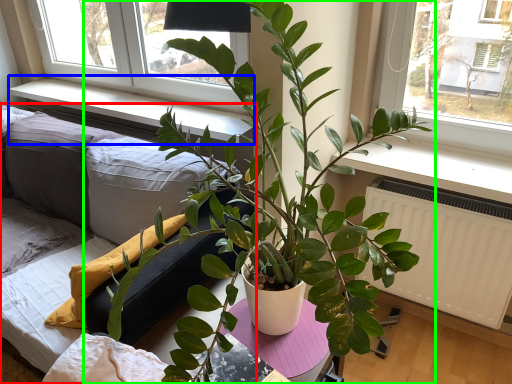
Question: Considering the real-world distances, which object is closest to studio couch (highlighted by a red box)? window sill (highlighted by a blue box) or houseplant (highlighted by a green box).

Choices:
 (A) window sill
 (B) houseplant

Answer: (A)